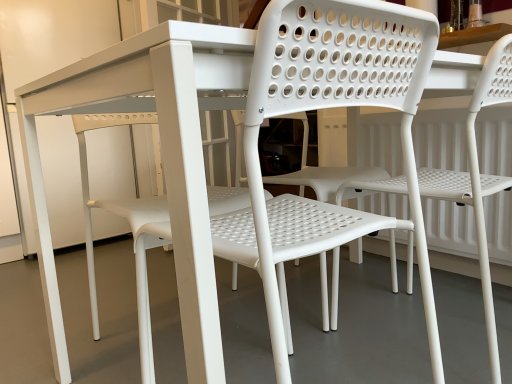
Identify the location of unoccupied space behind white plastic chair at center, the 1th chair when ordered from left to right. (291, 342).